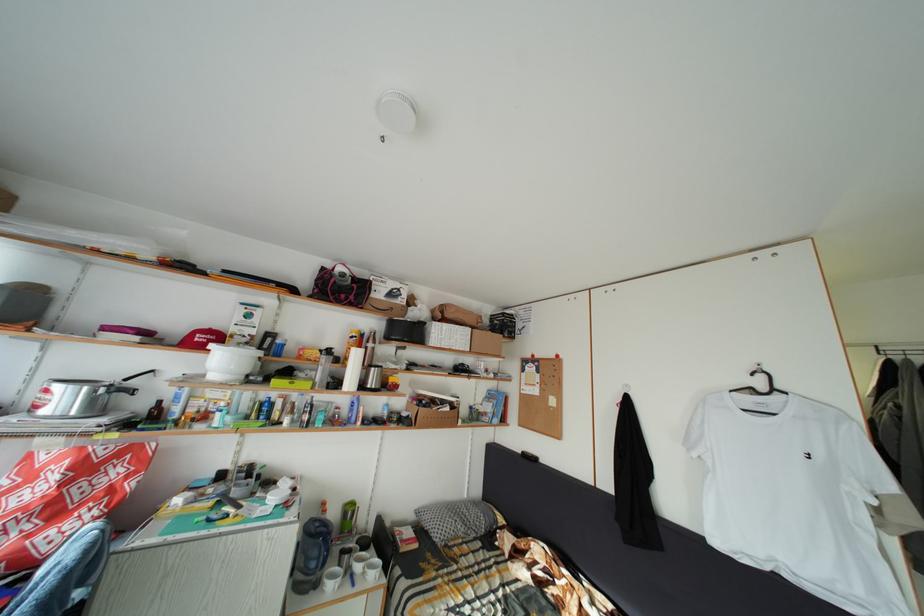
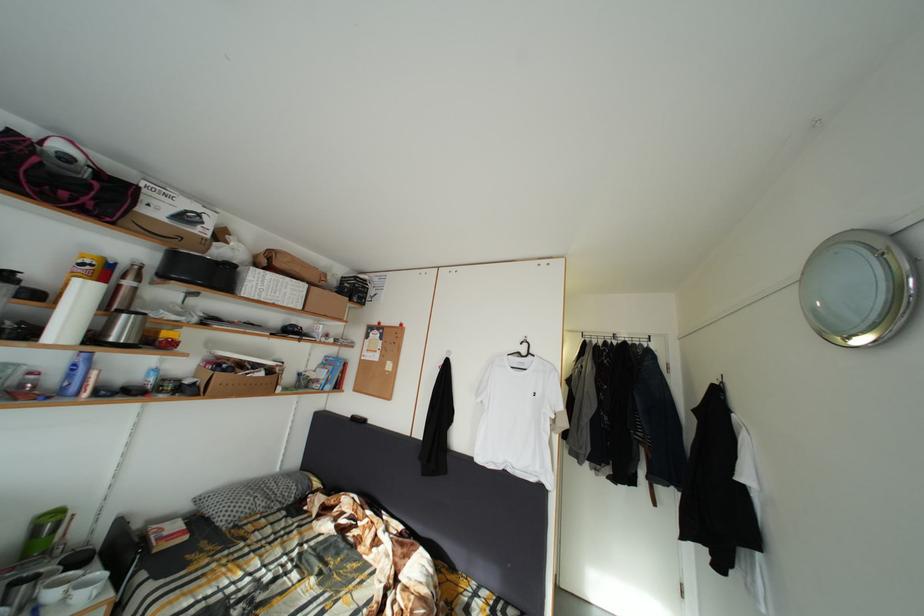
Find the pixel in the second image that matches pixel 452 408 in the first image.

(264, 373)